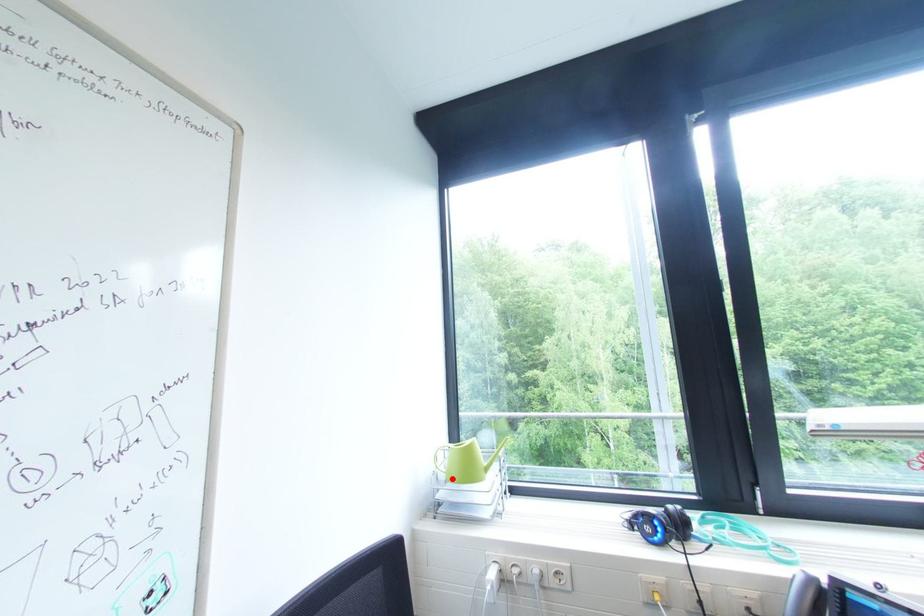
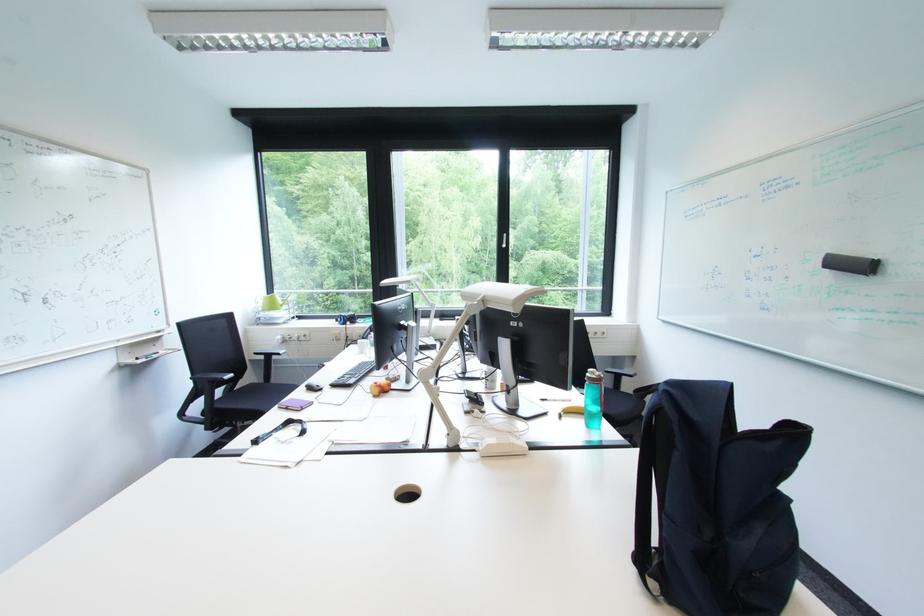
Where in the second image is the point corresponding to the highlighted location from the first image?

(270, 310)